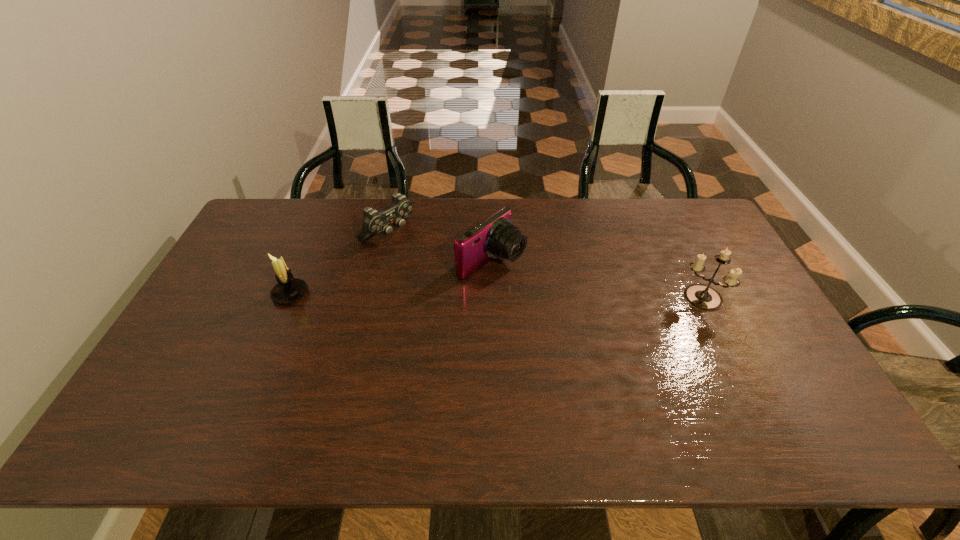
Locate an element on the screen. The width and height of the screenshot is (960, 540). free spot between the right candle holder and the camera is located at coordinates (596, 280).

Where is `vacant space that's between the control and the right candle holder`? This screenshot has height=540, width=960. vacant space that's between the control and the right candle holder is located at coordinates (544, 265).

The height and width of the screenshot is (540, 960). In order to click on vacant space that is in between the leftmost object and the control in this screenshot , I will do `click(339, 263)`.

Where is `free space between the second object from right to left and the right candle holder`? free space between the second object from right to left and the right candle holder is located at coordinates (596, 280).

The width and height of the screenshot is (960, 540). In order to click on blank region between the camera and the right candle holder in this screenshot , I will do `click(596, 280)`.

I want to click on vacant space in between the leftmost object and the right candle holder, so click(495, 296).

Image resolution: width=960 pixels, height=540 pixels. Find the location of `unoccupied position between the camera and the leftmost object`. unoccupied position between the camera and the leftmost object is located at coordinates (391, 278).

Where is `vacant area that lies between the camera and the rightmost object`? This screenshot has width=960, height=540. vacant area that lies between the camera and the rightmost object is located at coordinates (596, 280).

The height and width of the screenshot is (540, 960). I want to click on empty location between the right candle holder and the camera, so click(x=596, y=280).

Find the location of a particular element. free space between the right candle holder and the leftmost object is located at coordinates (495, 296).